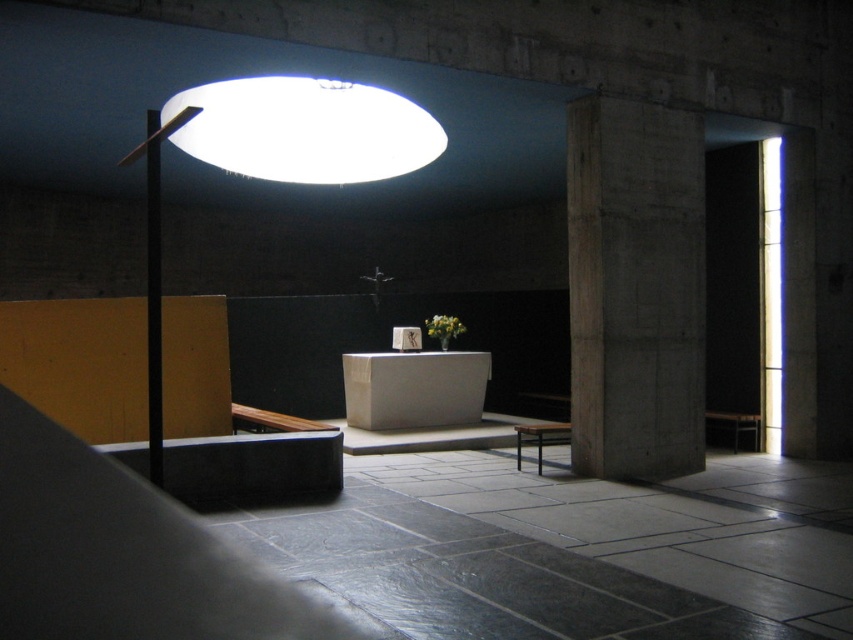
Is concrete pillar at center shorter than white matte lampshade at upper center?

In fact, concrete pillar at center may be taller than white matte lampshade at upper center.

Find the location of a particular element. This screenshot has height=640, width=853. concrete pillar at center is located at coordinates (635, 288).

Where is `concrete pillar at center`? Image resolution: width=853 pixels, height=640 pixels. concrete pillar at center is located at coordinates (635, 288).

Does concrete pillar at center appear under wooden stool at center?

Actually, concrete pillar at center is above wooden stool at center.

Looking at this image, is the position of concrete pillar at center more distant than that of wooden stool at center?

No, concrete pillar at center is in front of wooden stool at center.

At what (x,y) coordinates should I click in order to perform the action: click on concrete pillar at center. Please return your answer as a coordinate pair (x, y). The image size is (853, 640). Looking at the image, I should click on (635, 288).

Which is in front, point (315, 132) or point (564, 422)?

Point (315, 132) is in front.

Is matte black floor lamp at upper center positioned before wooden stool at center?

Yes, it is.

The width and height of the screenshot is (853, 640). Describe the element at coordinates (276, 157) in the screenshot. I see `matte black floor lamp at upper center` at that location.

Locate an element on the screen. matte black floor lamp at upper center is located at coordinates (276, 157).